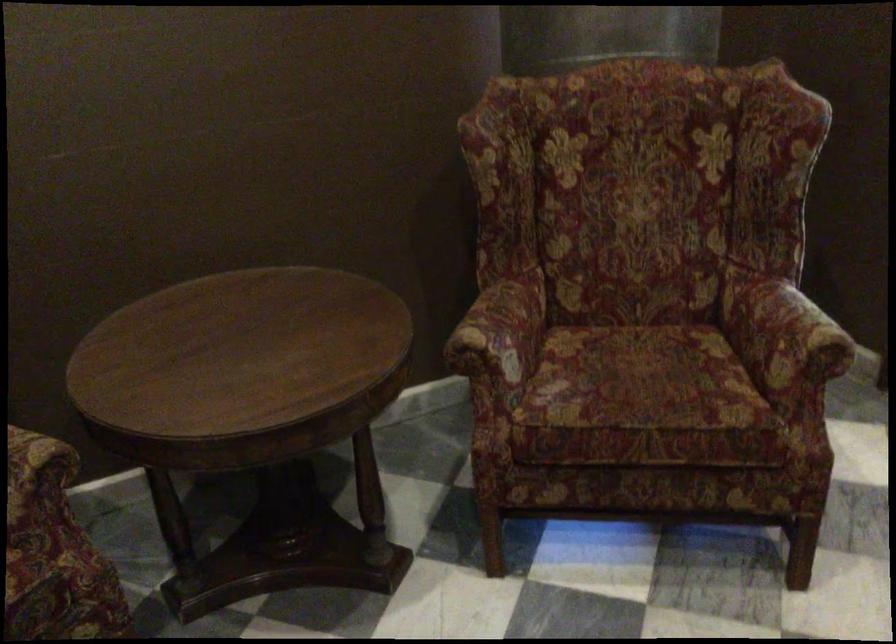
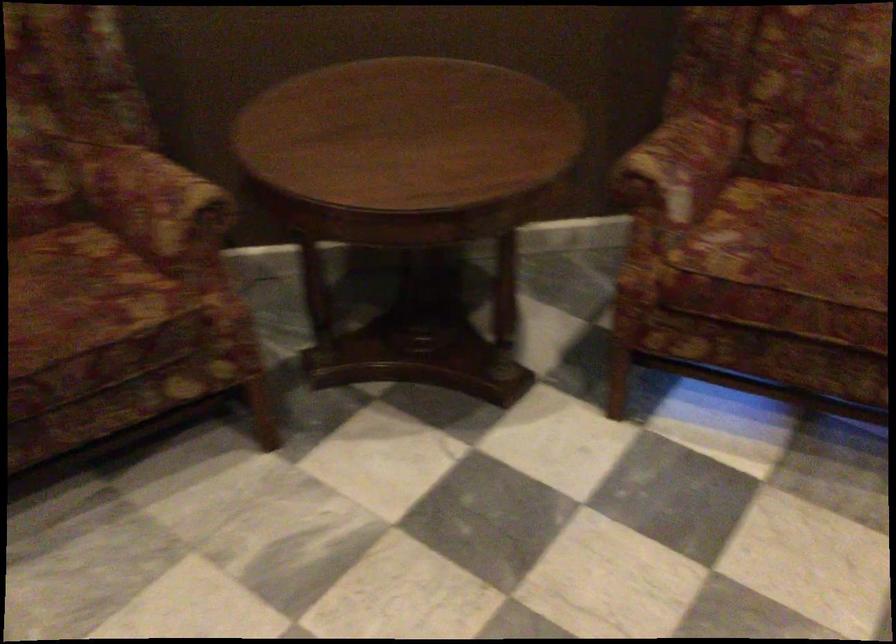
Question: The images are taken continuously from a first-person perspective. In which direction is your viewpoint rotating?

Choices:
 (A) Left
 (B) Right
 (C) Up
 (D) Down

Answer: (D)